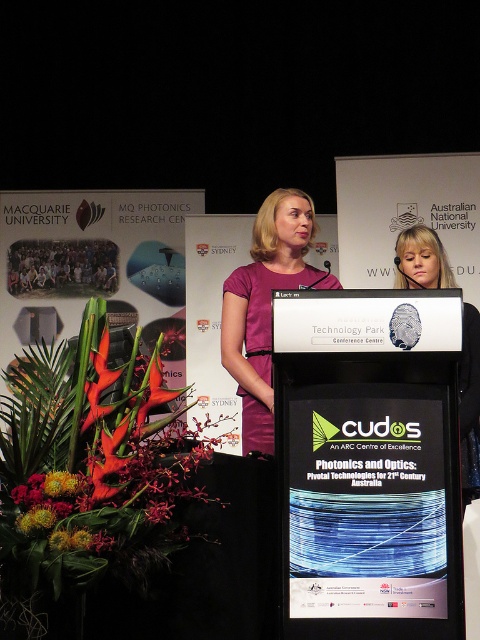
You are an event organizer at the conference and need to ensure that the two purple dresses at center are appropriately spaced for a group photo. Given that the purple matte dress at center is wider than the matte purple dress at center, how should you position them to avoid overlapping?

Since the purple matte dress at center is wider than the matte purple dress at center, position the wider purple matte dress at center slightly to one side and the narrower matte purple dress at center closer to the center to prevent overlap while accommodating their widths.

You are attending a conference at the Macquarie University MQ Photonics Research Centre and notice the purple matte dress at center. Can you determine its exact coordinates in the image?

The purple matte dress at center is located at point (x=265, y=305).